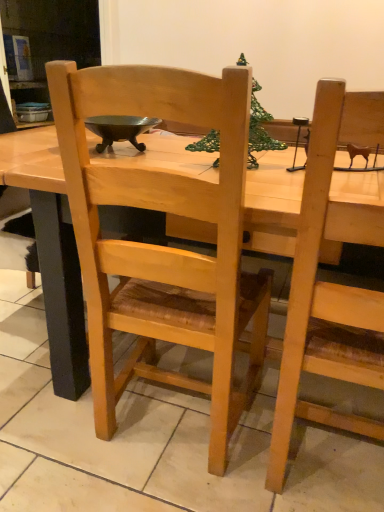
Question: In the image, is natural wood chair at center on the left side or the right side of wooden table at center?

Choices:
 (A) right
 (B) left

Answer: (A)

Question: Is natural wood chair at center inside or outside of wooden table at center?

Choices:
 (A) outside
 (B) inside

Answer: (B)

Question: Considering the positions of natural wood chair at center and wooden table at center in the image, is natural wood chair at center taller or shorter than wooden table at center?

Choices:
 (A) short
 (B) tall

Answer: (B)

Question: In the image, is wooden table at center positioned in front of or behind natural wood chair at center?

Choices:
 (A) front
 (B) behind

Answer: (B)

Question: Is wooden table at center taller or shorter than natural wood chair at center?

Choices:
 (A) short
 (B) tall

Answer: (A)

Question: In the image, is wooden table at center on the left side or the right side of natural wood chair at center?

Choices:
 (A) left
 (B) right

Answer: (A)

Question: Considering the positions of wooden table at center and natural wood chair at center in the image, is wooden table at center bigger or smaller than natural wood chair at center?

Choices:
 (A) big
 (B) small

Answer: (A)